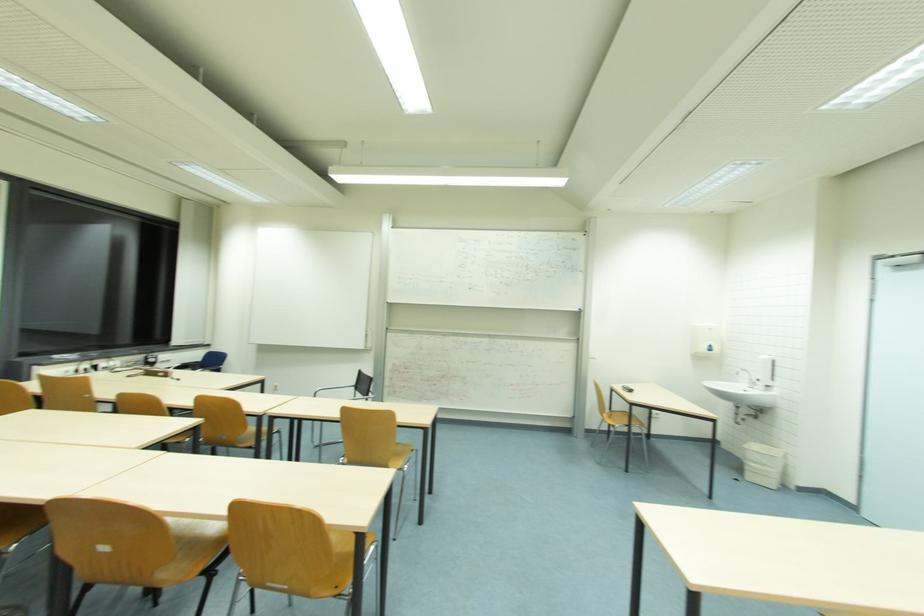
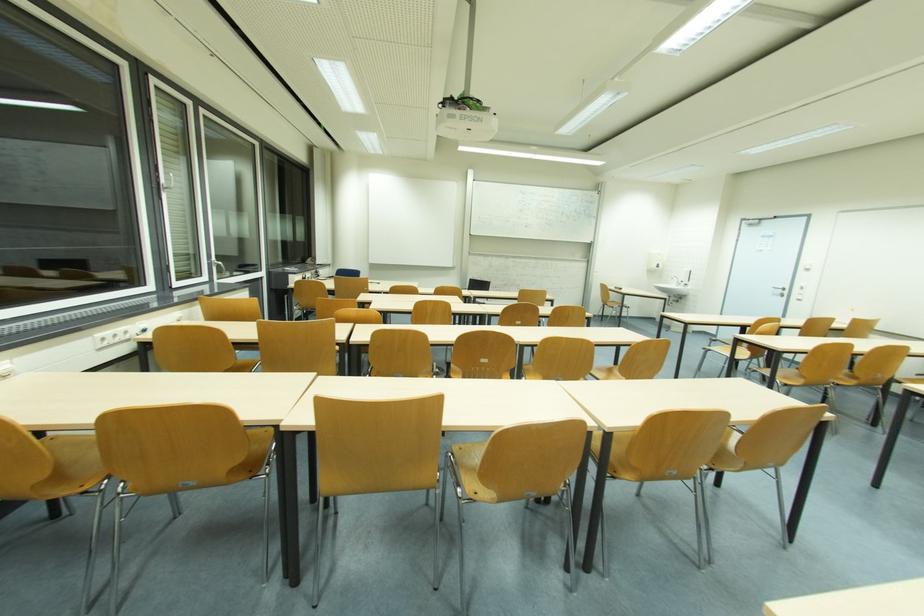
Based on the photo, which direction would the cameraman need to move to produce the second image?

A: The movement direction of the cameraman is left, backward.